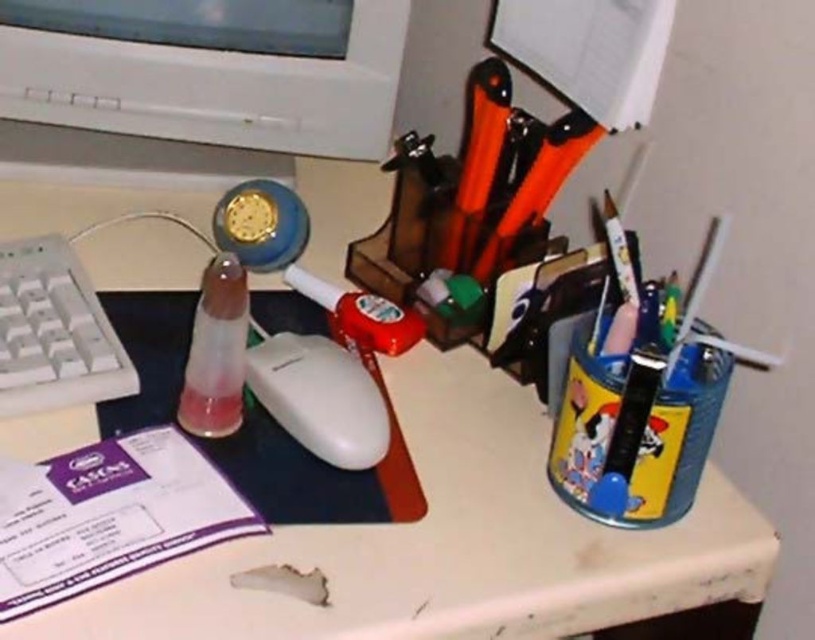
Question: Which point appears closest to the camera in this image?

Choices:
 (A) (300, 408)
 (B) (298, 291)
 (C) (382, 148)
 (D) (16, 369)

Answer: (D)

Question: Is white plastic monitor at upper left below glossy plastic glue stick at center?

Choices:
 (A) no
 (B) yes

Answer: (A)

Question: Can you confirm if white matte mouse at center is positioned to the right of glossy plastic glue stick at center?

Choices:
 (A) no
 (B) yes

Answer: (A)

Question: Which of the following is the farthest from the observer?

Choices:
 (A) white matte mouse at center
 (B) translucent plastic pen at center

Answer: (A)

Question: Is white matte keyboard at left further to camera compared to white matte mouse at center?

Choices:
 (A) yes
 (B) no

Answer: (B)

Question: Which of the following is the closest to the observer?

Choices:
 (A) white matte keyboard at left
 (B) glossy plastic glue stick at center

Answer: (A)